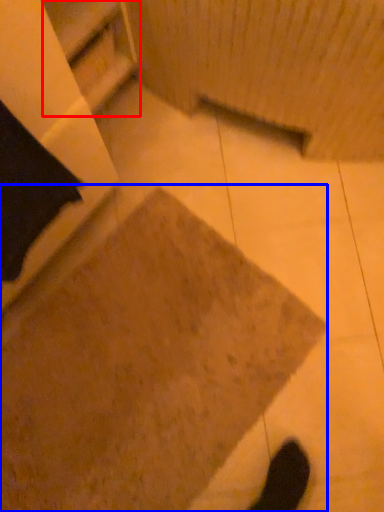
Question: Among these objects, which one is nearest to the camera, shelf (highlighted by a red box) or concrete (highlighted by a blue box)?

Choices:
 (A) shelf
 (B) concrete

Answer: (A)